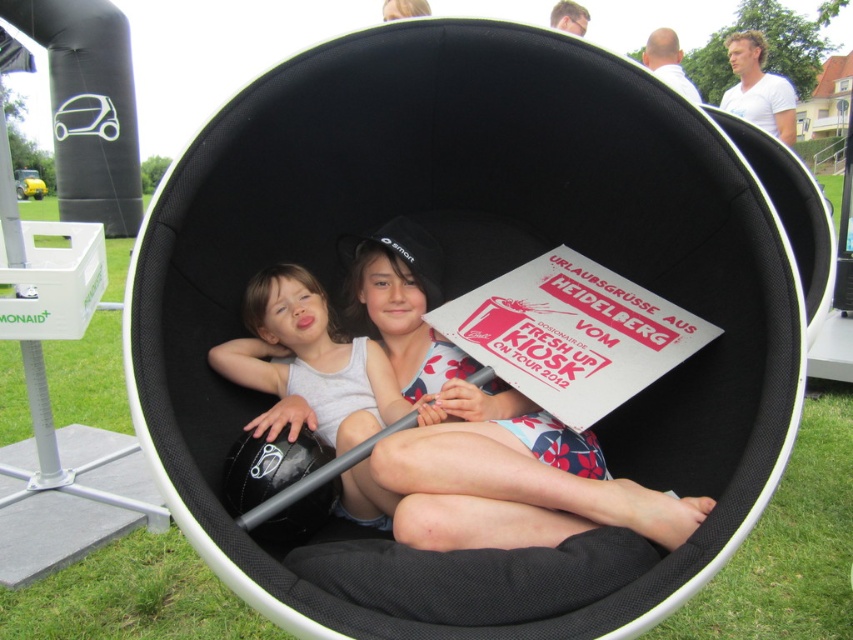
You are a photographer trying to capture the two children in the matte black hat at center and the matte white tank top at center for a magazine spread. You want to ensure that the child with the matte black hat is positioned to the right of the child in the matte white tank top in the final photo. Based on the scene, is this arrangement already achievable without moving anyone?

Yes, the arrangement is already achievable because the matte black hat at center is currently positioned to the right of the matte white tank top at center, as described in the scene.

You are a photographer at the event and want to capture a photo of the two children inside the pod. Since you can only focus on one child at a time, which child should you focus on to ensure the matte black hat at center and the matte white tank top at center are both clearly visible in the photo?

You should focus on the child wearing the matte white tank top at center because the matte black hat at center is above it, meaning both will be in focus if the lower object is the main focus.

You are a photographer standing at the camera position. You want to place a small sticker on the exact point where the sign is located, which is at point (579, 480). The sticker has a diameter of 0.2 meters. Will the sticker fit without overlapping any other objects in the scene?

The point (579, 480) is 1.44 meters from the camera. Since the sticker has a diameter of 0.2 meters, it can be placed there without overlapping other objects as long as there is enough space. However, without knowing the exact positions and sizes of nearby objects, it is impossible to confirm definitively. But according to the given information, the distance alone suggests it might fit.